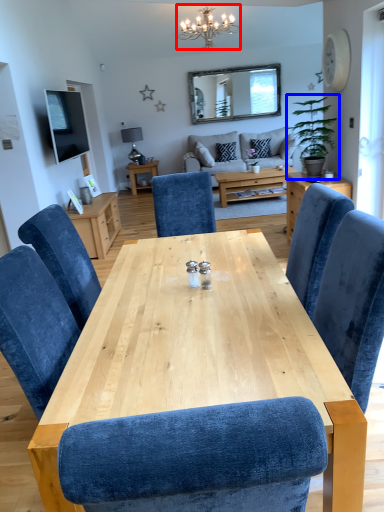
Question: Which object is closer to the camera taking this photo, light fixture (highlighted by a red box) or houseplant (highlighted by a blue box)?

Choices:
 (A) light fixture
 (B) houseplant

Answer: (B)